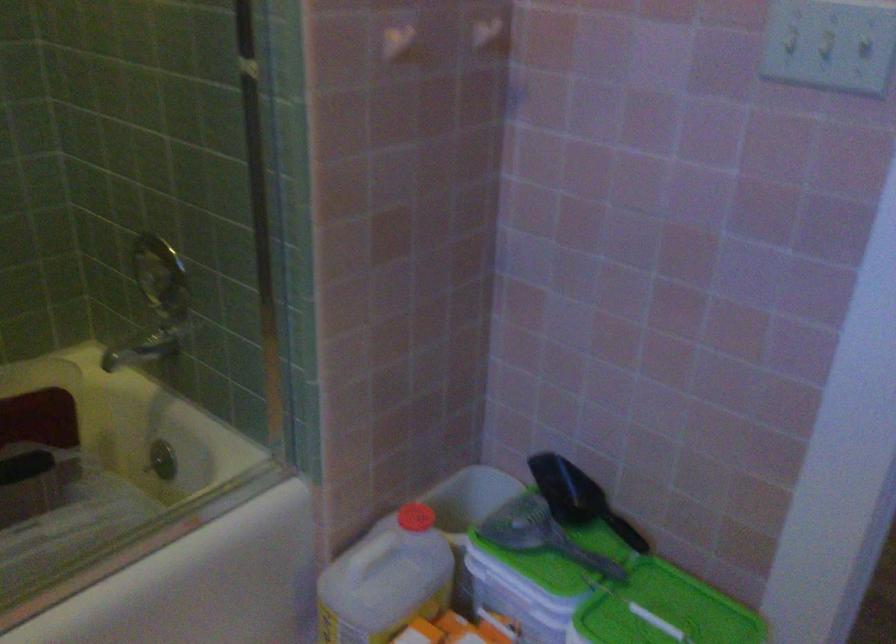
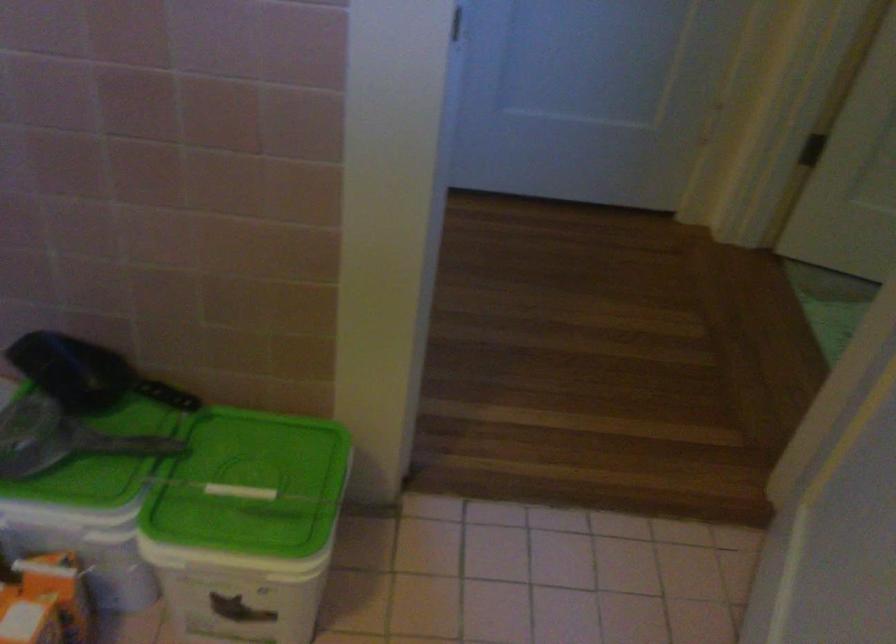
The images are taken continuously from a first-person perspective. In which direction is your viewpoint rotating?

The camera's rotation is toward right-down.